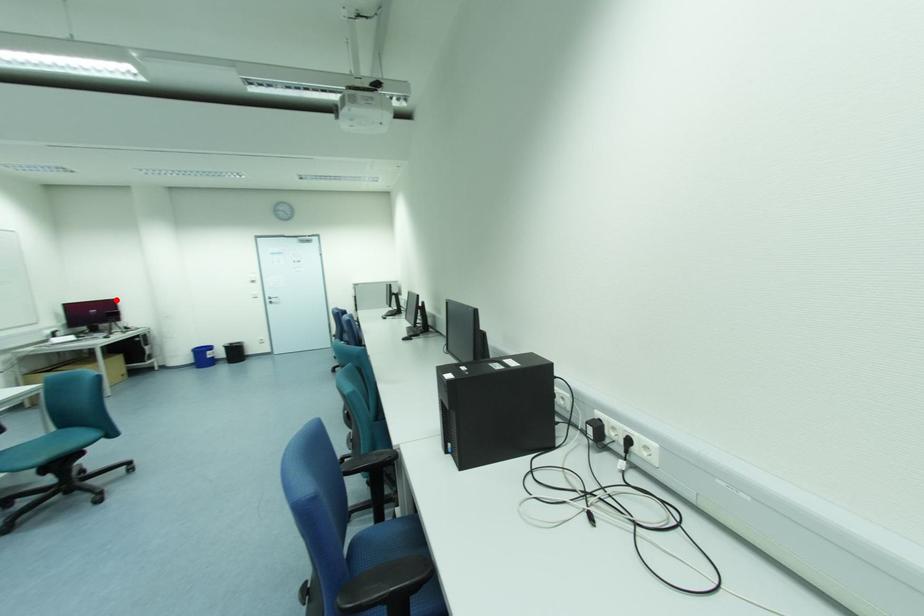
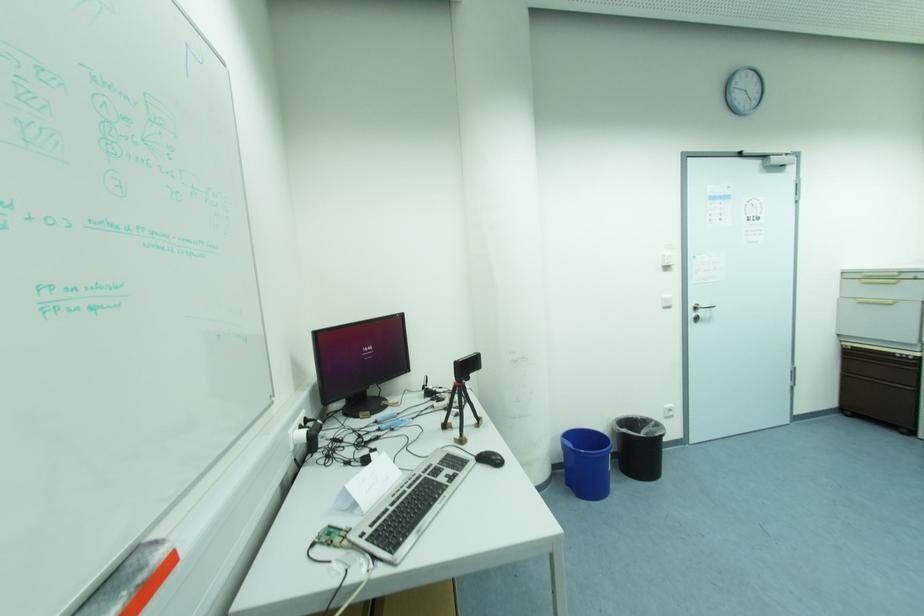
Question: I am providing you with two images of the same scene from different viewpoints. In image1, a red point is highlighted. Considering the same 3D point in image2, which of the following is correct?

Choices:
 (A) It is closer
 (B) It is farther

Answer: (B)